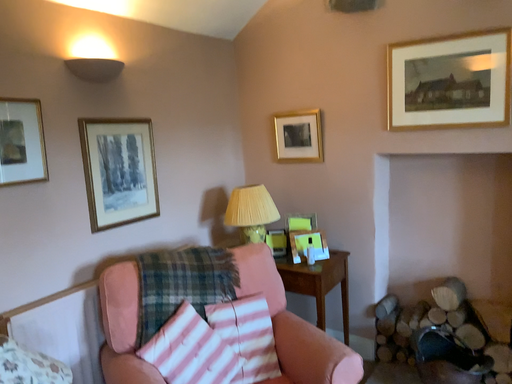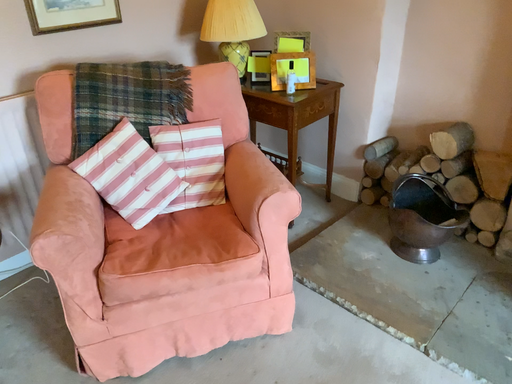
Question: Which way did the camera rotate in the video?

Choices:
 (A) rotated right
 (B) rotated left

Answer: (B)